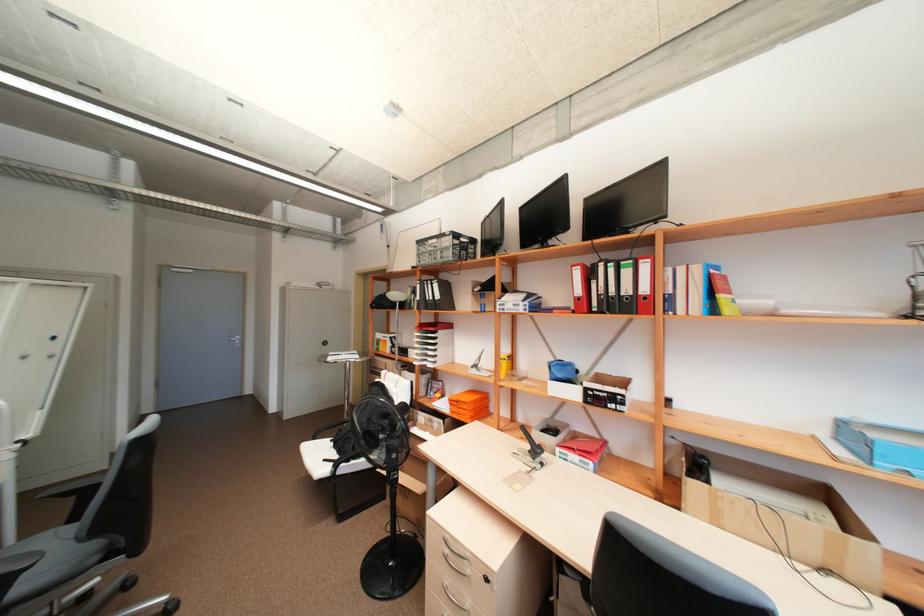
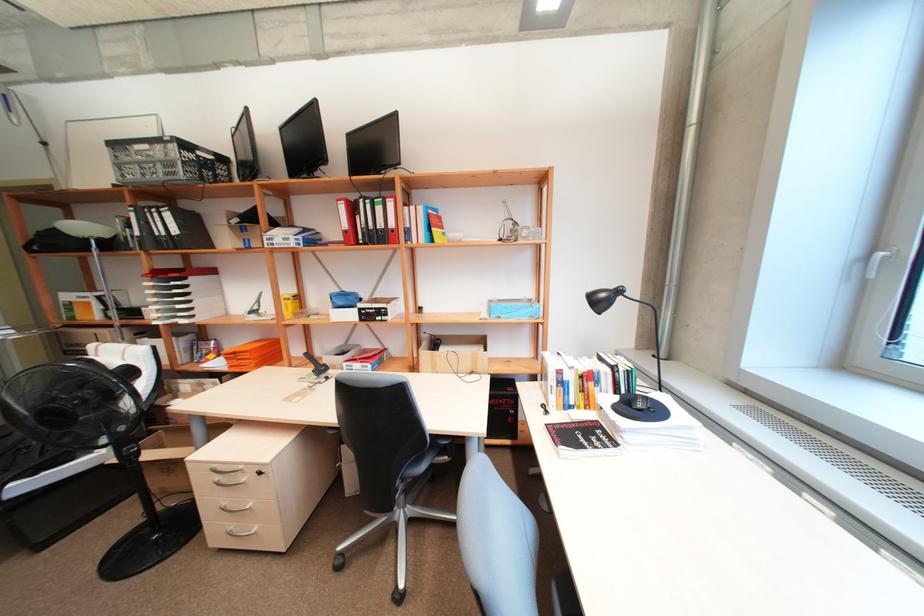
Question: The first image is from the beginning of the video and the second image is from the end. How did the camera likely rotate when shooting the video?

Choices:
 (A) Left
 (B) Right
 (C) Up
 (D) Down

Answer: (B)